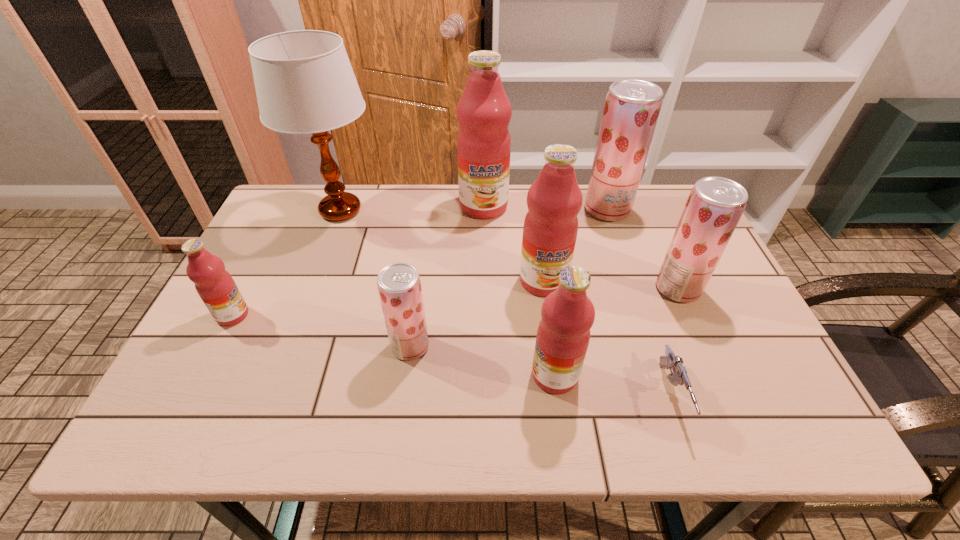
Where is `table lamp`? table lamp is located at coordinates (304, 81).

You are a GUI agent. You are given a task and a screenshot of the screen. Output one action in this format:
    pyautogui.click(x=<x>, y=<y>)
    Task: Click on the tallest fruit juice
    
    Given the screenshot: What is the action you would take?
    pyautogui.click(x=484, y=111)

The image size is (960, 540). Find the location of `the sixth object from right to left`. the sixth object from right to left is located at coordinates [484, 111].

The height and width of the screenshot is (540, 960). I want to click on the biggest strawberry fruit juice, so click(x=632, y=106).

This screenshot has height=540, width=960. I want to click on the second farthest pink fruit juice, so click(554, 200).

Identify the location of the second nearest strawberry fruit juice. The image size is (960, 540). (715, 205).

This screenshot has height=540, width=960. I want to click on the second smallest pink fruit juice, so pos(567,314).

Identify the location of the leftmost fruit juice. Image resolution: width=960 pixels, height=540 pixels. (215, 286).

What are the coordinates of `the smallest pink fruit juice` in the screenshot? It's located at (215, 286).

Where is `the smallest strawberry fruit juice`? This screenshot has width=960, height=540. the smallest strawberry fruit juice is located at coordinates pyautogui.click(x=399, y=286).